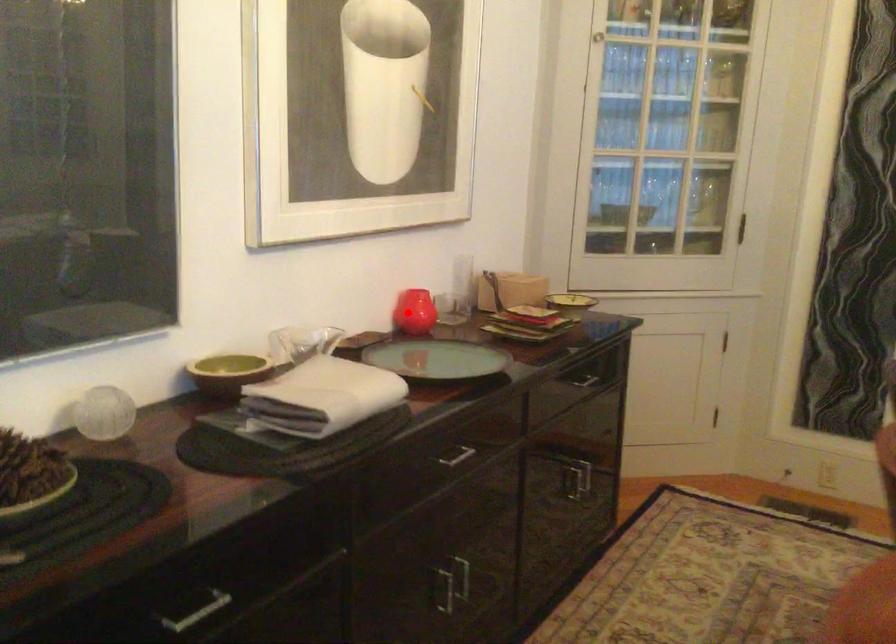
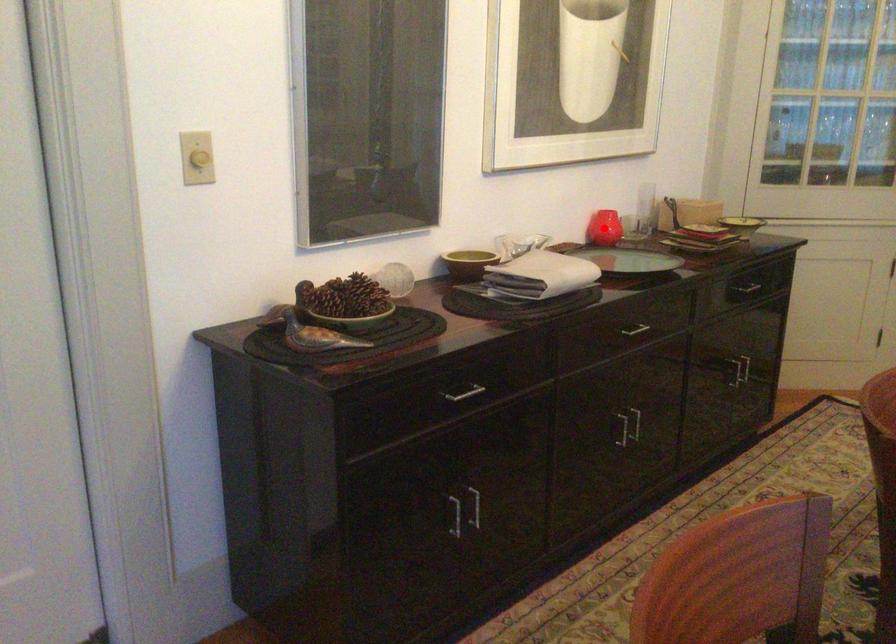
I am providing you with two images of the same scene from different viewpoints. A red point is marked on the first image and another point is marked on the second image. Does the point marked in image1 correspond to the same location as the one in image2?

Yes